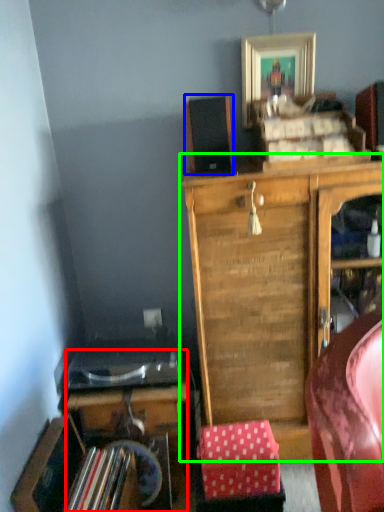
Question: Which is farther away from desk (highlighted by a red box)? speaker (highlighted by a blue box) or cabinetry (highlighted by a green box)?

Choices:
 (A) speaker
 (B) cabinetry

Answer: (A)